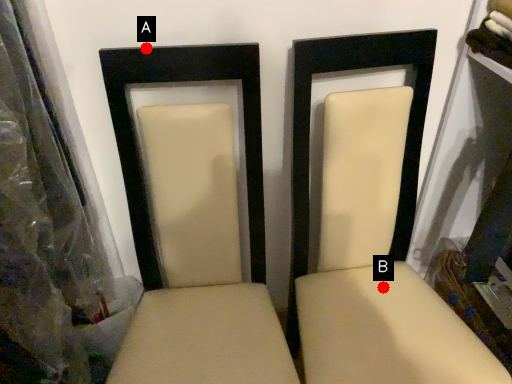
Question: Two points are circled on the image, labeled by A and B beside each circle. Which point is farther from the camera taking this photo?

Choices:
 (A) A is further
 (B) B is further

Answer: (B)